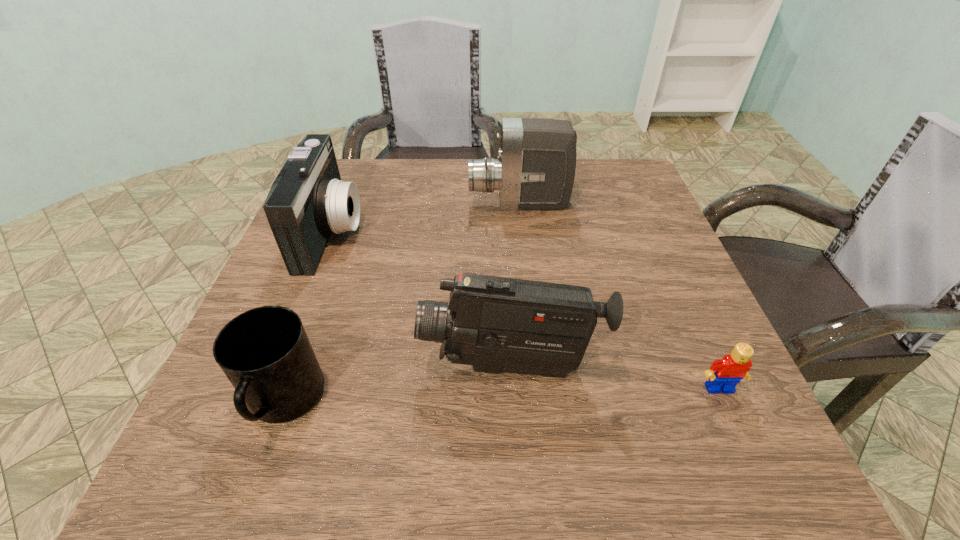
You are a GUI agent. You are given a task and a screenshot of the screen. Output one action in this format:
    pyautogui.click(x=<x>, y=<y>)
    Task: Click on the free spot at the far right corner of the desktop
    
    Given the screenshot: What is the action you would take?
    pyautogui.click(x=622, y=205)

Where is `vacant region between the second shortest object and the nearest camcorder`? vacant region between the second shortest object and the nearest camcorder is located at coordinates (397, 385).

Locate an element on the screen. The height and width of the screenshot is (540, 960). free space between the mug and the nearest camcorder is located at coordinates (397, 385).

The width and height of the screenshot is (960, 540). What are the coordinates of `free space between the mug and the leftmost camcorder` in the screenshot? It's located at (308, 317).

You are a GUI agent. You are given a task and a screenshot of the screen. Output one action in this format:
    pyautogui.click(x=<x>, y=<y>)
    Task: Click on the vacant point located between the Lego and the nearest camcorder
    The width and height of the screenshot is (960, 540).
    Given the screenshot: What is the action you would take?
    pyautogui.click(x=614, y=378)

Select which object is the second closest to the leftmost camcorder. Please provide its 2D coordinates. Your answer should be formatted as a tuple, i.e. [(x, y)], where the tuple contains the x and y coordinates of a point satisfying the conditions above.

[(536, 165)]

Image resolution: width=960 pixels, height=540 pixels. Find the location of `object that is the fourth closest to the rightmost object`. object that is the fourth closest to the rightmost object is located at coordinates pyautogui.click(x=308, y=201).

Where is `camcorder that is the second closest to the Lego`? camcorder that is the second closest to the Lego is located at coordinates (536, 165).

Find the location of a particular element. camcorder object that ranks as the closest to the shortest object is located at coordinates (496, 324).

At what (x,y) coordinates should I click in order to perform the action: click on free space that satisfies the following two spatial constraints: 1. on the front-facing side of the nearest camcorder; 2. on the side of the mug with the handle. Please return your answer as a coordinate pair (x, y). Looking at the image, I should click on (512, 402).